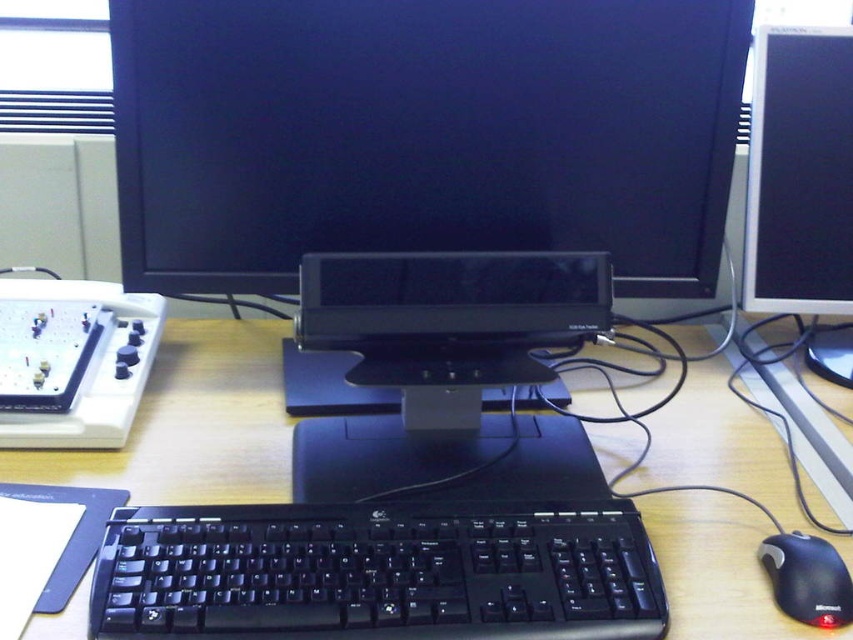
Consider the image. You are setting up a new computer desk and want to place a cup between the black plastic monitor at center and the black plastic mouse at lower right. Based on their positions, where should you place the cup to ensure it is between them?

The cup should be placed to the right of the black plastic monitor at center and to the left of the black plastic mouse at lower right since the monitor is to the left of the mouse.

You are setting up a video call and need to position your camera so that it captures the black glossy monitor at center clearly. The recommended distance between the camera and the monitor is 30 inches for optimal framing. Is the current distance sufficient?

The black glossy monitor at center and the camera are 31.57 inches apart, which is slightly more than the recommended 30 inches. This distance might still work but could result in a slightly wider frame than intended.

You have a 16 inch wide laptop that you want to place between the black glossy monitor at center and the wooden desk at center. Can the laptop fit in that space?

The space between the black glossy monitor at center and the wooden desk at center is 15.81 inches. Since the laptop is 16 inches wide, it cannot fit in that space.